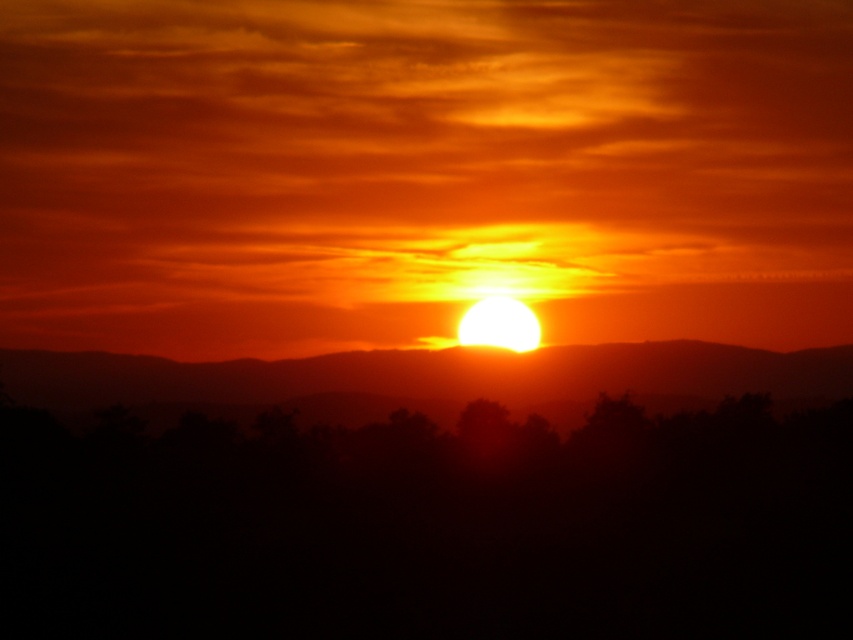
Question: Does black matte tree at center lie behind silhouetted rock at center?

Choices:
 (A) yes
 (B) no

Answer: (B)

Question: Which point appears closest to the camera in this image?

Choices:
 (A) (306, 596)
 (B) (230, 378)

Answer: (A)

Question: Can you confirm if black matte tree at center is positioned to the right of silhouetted rock at center?

Choices:
 (A) yes
 (B) no

Answer: (B)

Question: Does black matte tree at center appear over silhouetted rock at center?

Choices:
 (A) yes
 (B) no

Answer: (A)